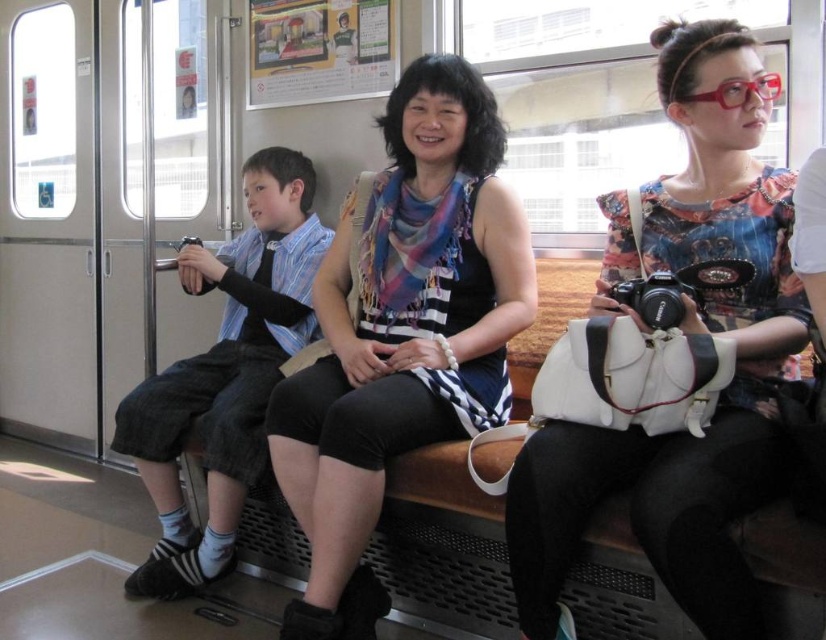
Question: Which is farther from the matte black scarf at center?

Choices:
 (A) printed fabric shirt at center
 (B) denim shorts at left

Answer: (B)

Question: Observing the image, what is the correct spatial positioning of matte black scarf at center in reference to denim shorts at left?

Choices:
 (A) below
 (B) above

Answer: (B)

Question: Can you confirm if printed fabric shirt at center is bigger than denim shorts at left?

Choices:
 (A) yes
 (B) no

Answer: (B)

Question: Which object appears closest to the camera in this image?

Choices:
 (A) printed fabric shirt at center
 (B) matte black scarf at center

Answer: (A)

Question: Is printed fabric shirt at center smaller than denim shorts at left?

Choices:
 (A) yes
 (B) no

Answer: (A)

Question: Which of these objects is positioned farthest from the denim shorts at left?

Choices:
 (A) matte black scarf at center
 (B) printed fabric shirt at center

Answer: (B)